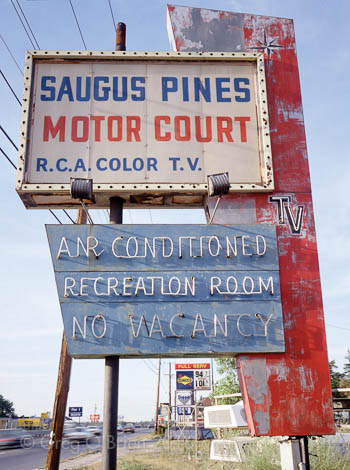
Locate an element on the screen. neon words is located at coordinates (164, 247), (94, 244), (114, 287), (234, 289), (223, 321), (89, 325).